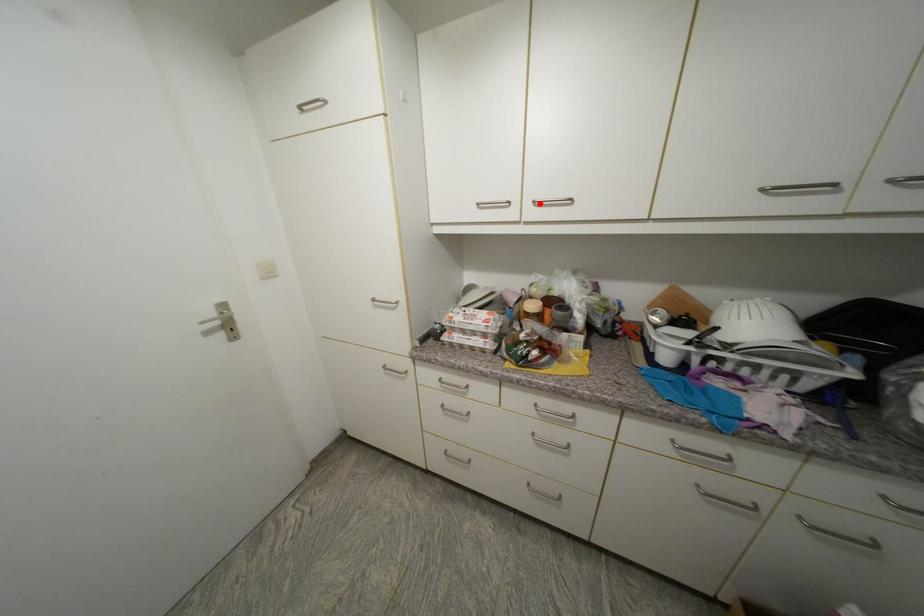
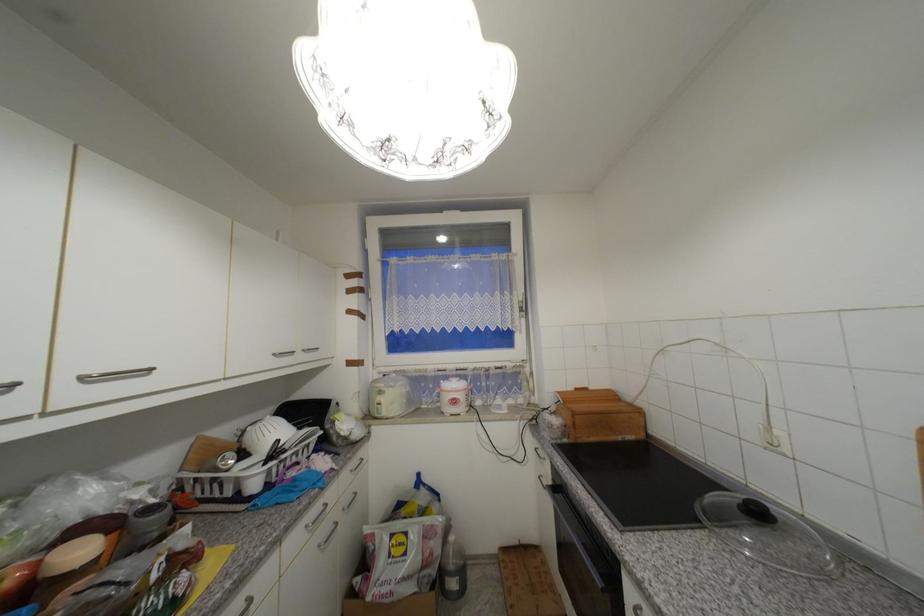
Where in the second image is the point corresponding to the highlighted location from the first image?

(89, 379)